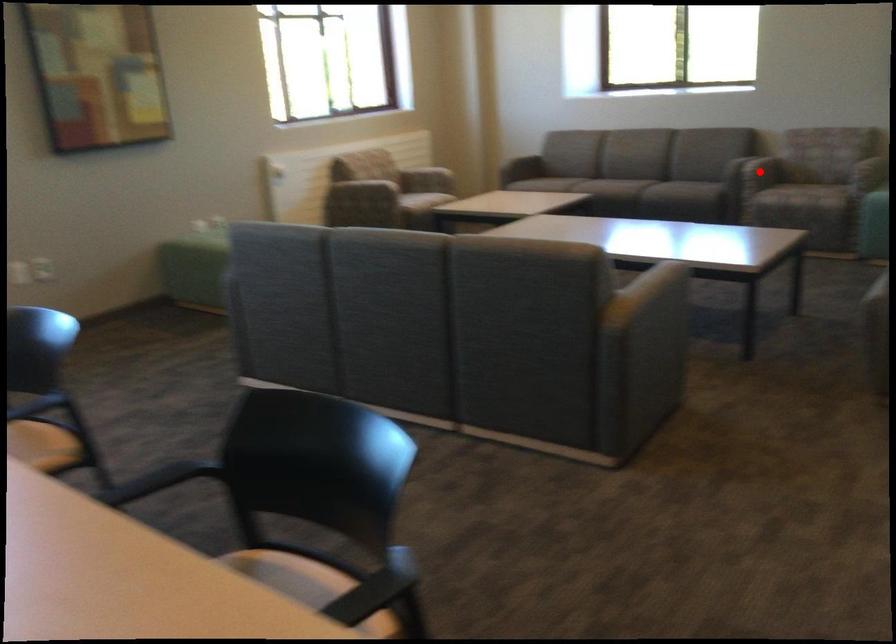
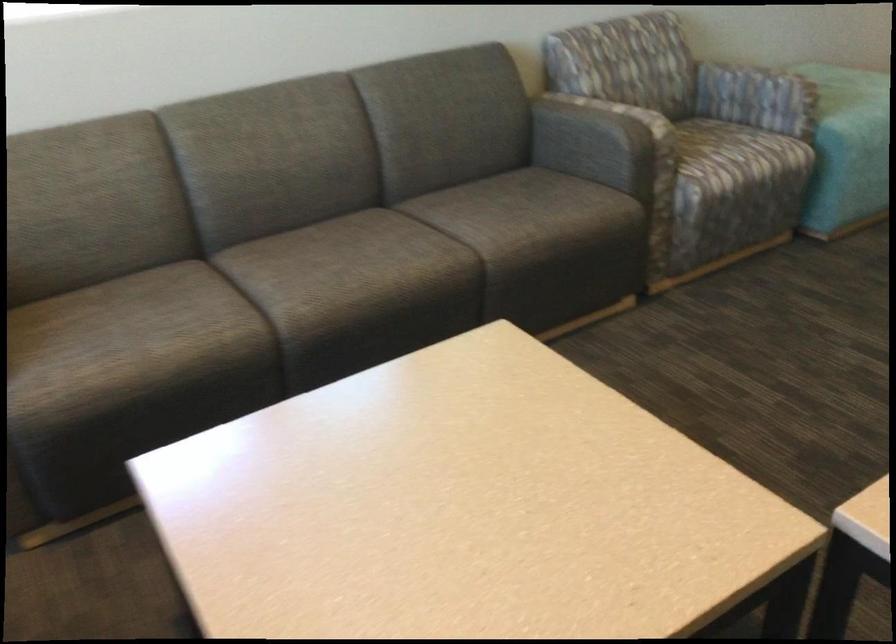
Question: I am providing you with two images of the same scene from different viewpoints. A red point is marked on the first image. Is the red point's position out of view in image 2?

Choices:
 (A) Yes
 (B) No

Answer: (A)